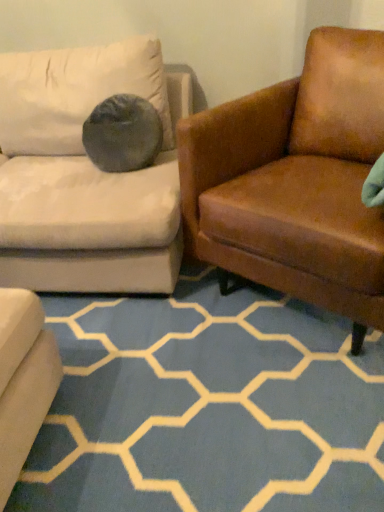
Question: Which is correct: blue carpet at center is inside brown leather armchair at right, or outside of it?

Choices:
 (A) inside
 (B) outside

Answer: (B)

Question: Considering the positions of point 124,481 and point 324,136, is point 124,481 closer or farther from the camera than point 324,136?

Choices:
 (A) farther
 (B) closer

Answer: (B)

Question: Visually, is blue carpet at center positioned to the left or to the right of brown leather armchair at right?

Choices:
 (A) left
 (B) right

Answer: (A)

Question: Is point [276, 287] positioned closer to the camera than point [187, 403]?

Choices:
 (A) closer
 (B) farther

Answer: (B)

Question: From a real-world perspective, relative to blue carpet at center, is brown leather armchair at right vertically above or below?

Choices:
 (A) above
 (B) below

Answer: (A)

Question: In terms of width, does brown leather armchair at right look wider or thinner when compared to blue carpet at center?

Choices:
 (A) thin
 (B) wide

Answer: (B)

Question: Visually, is brown leather armchair at right positioned to the left or to the right of blue carpet at center?

Choices:
 (A) right
 (B) left

Answer: (A)